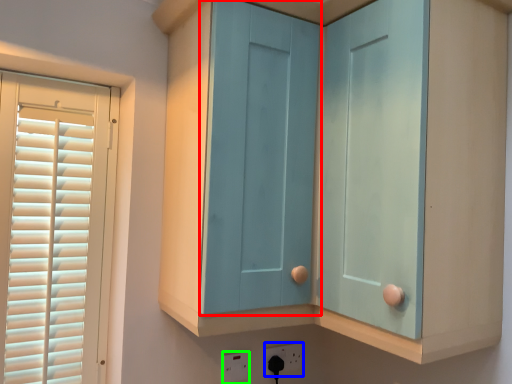
Question: Considering the real-world distances, which object is farthest from screen door (highlighted by a red box)? electric outlet (highlighted by a blue box) or electric outlet (highlighted by a green box)?

Choices:
 (A) electric outlet
 (B) electric outlet

Answer: (A)